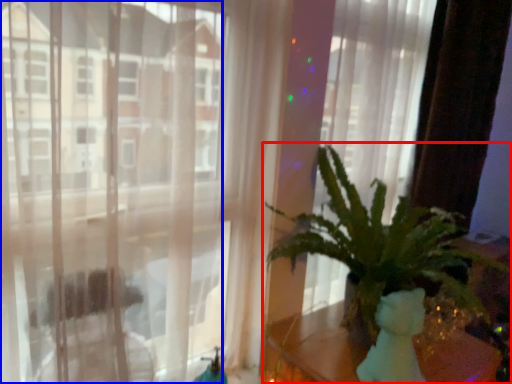
Question: Which of the following is the closest to the observer, houseplant (highlighted by a red box) or window (highlighted by a blue box)?

Choices:
 (A) houseplant
 (B) window

Answer: (A)